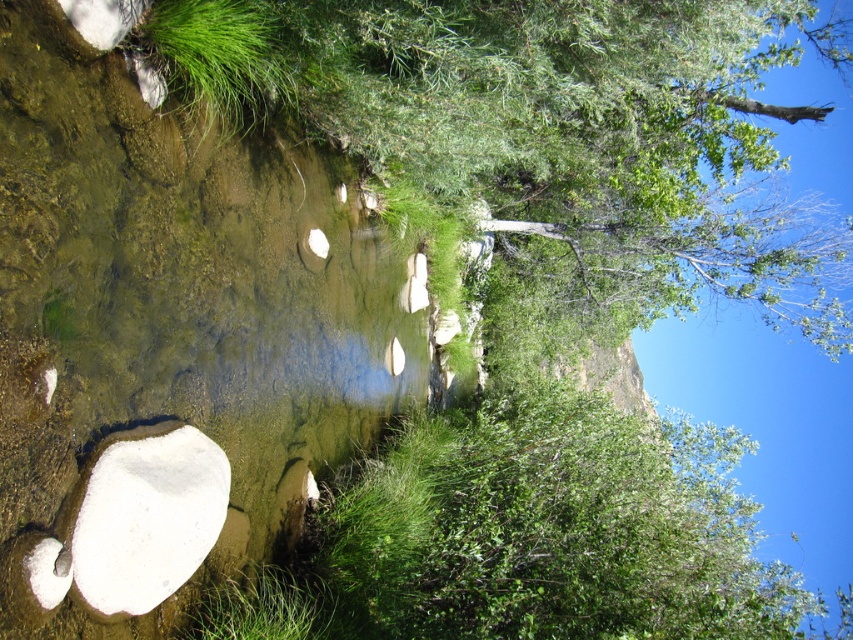
Question: Which point is farther to the camera?

Choices:
 (A) (160, 36)
 (B) (281, 570)

Answer: (B)

Question: Does green leafy grass at upper left have a larger size compared to green leafy grass at lower center?

Choices:
 (A) yes
 (B) no

Answer: (A)

Question: Which point appears closest to the camera in this image?

Choices:
 (A) (808, 1)
 (B) (173, 68)
 (C) (279, 600)

Answer: (C)

Question: Can you confirm if green leafy tree at center is wider than green leafy grass at upper left?

Choices:
 (A) no
 (B) yes

Answer: (B)

Question: Is green leafy tree at center above green leafy grass at upper left?

Choices:
 (A) yes
 (B) no

Answer: (B)

Question: Which point is closer to the camera taking this photo?

Choices:
 (A) (257, 600)
 (B) (848, 232)

Answer: (A)